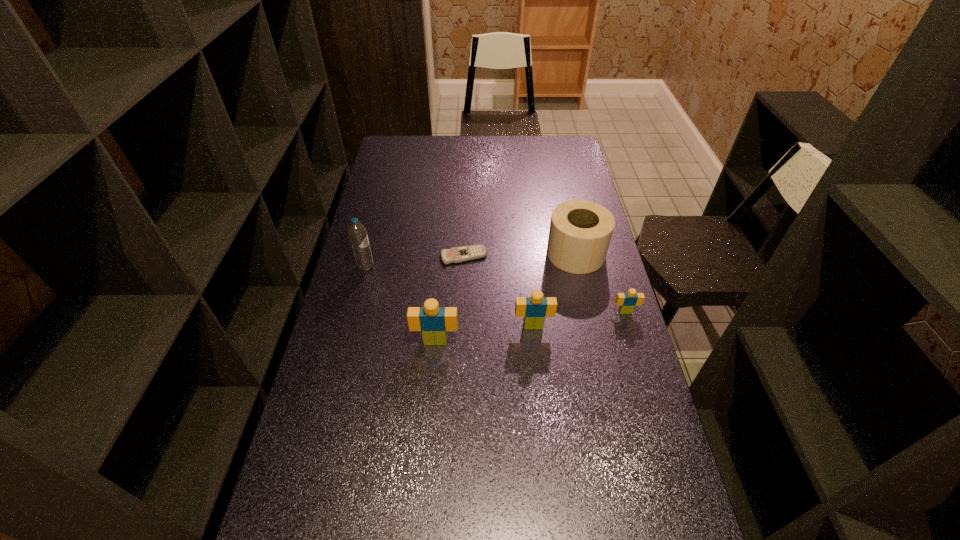
This screenshot has height=540, width=960. I want to click on free space located 0.190m on the face of the leftmost Lego, so click(x=430, y=406).

The height and width of the screenshot is (540, 960). Identify the location of vacant space located 0.330m on the face of the second farthest Lego. (544, 436).

Find the location of `vacant space located on the face of the fourth farthest object`. vacant space located on the face of the fourth farthest object is located at coordinates (631, 330).

Find the location of a particular element. free space located on the front of the toilet tissue is located at coordinates (595, 341).

Where is `blank space located on the back of the shortest object`? blank space located on the back of the shortest object is located at coordinates (466, 198).

Where is `free location located on the back of the leftmost object`? This screenshot has height=540, width=960. free location located on the back of the leftmost object is located at coordinates click(x=384, y=198).

Where is `object that is at the left edge`? object that is at the left edge is located at coordinates (357, 232).

I want to click on Lego at the right edge, so click(x=627, y=301).

This screenshot has height=540, width=960. What are the coordinates of `toilet tissue situated at the right edge` in the screenshot? It's located at (580, 232).

Identify the location of vacant space at the far edge. (524, 154).